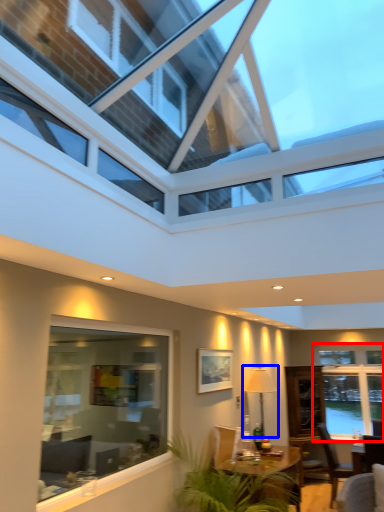
Question: Which object is closer to the camera taking this photo, window (highlighted by a red box) or lamp (highlighted by a blue box)?

Choices:
 (A) window
 (B) lamp

Answer: (B)